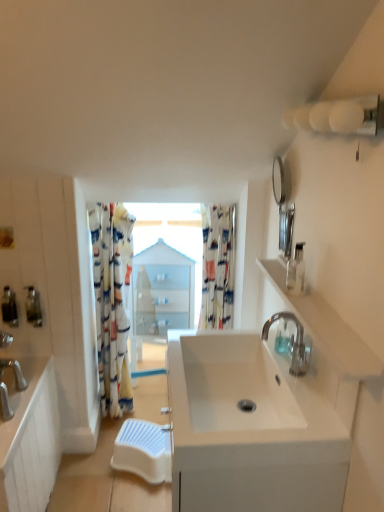
Question: Is translucent plastic soap dispenser at left, the 2th soap dispenser positioned from the right, directly adjacent to satin nickel cabinet at left?

Choices:
 (A) no
 (B) yes

Answer: (A)

Question: From the image's perspective, does translucent plastic soap dispenser at left, which is counted as the 1th soap dispenser, starting from the back, appear lower than satin nickel cabinet at left?

Choices:
 (A) yes
 (B) no

Answer: (B)

Question: Is translucent plastic soap dispenser at left, which appears as the 2th soap dispenser when viewed from the left, closer to the viewer compared to satin nickel cabinet at left?

Choices:
 (A) no
 (B) yes

Answer: (A)

Question: Considering the relative sizes of translucent plastic soap dispenser at left, the 2th soap dispenser positioned from the right, and satin nickel cabinet at left in the image provided, is translucent plastic soap dispenser at left, the 2th soap dispenser positioned from the right, thinner than satin nickel cabinet at left?

Choices:
 (A) no
 (B) yes

Answer: (B)

Question: Are translucent plastic soap dispenser at left, which appears as the 2th soap dispenser when viewed from the left, and satin nickel cabinet at left far apart?

Choices:
 (A) yes
 (B) no

Answer: (B)

Question: Is polished chrome faucet at center right taller or shorter than matte silver soap dispenser at left, which is the first soap dispenser in left-to-right order?

Choices:
 (A) short
 (B) tall

Answer: (B)

Question: Is point (296, 358) positioned closer to the camera than point (6, 303)?

Choices:
 (A) closer
 (B) farther

Answer: (A)

Question: From the image's perspective, is polished chrome faucet at center right located above or below matte silver soap dispenser at left, which is the 2th soap dispenser in back-to-front order?

Choices:
 (A) below
 (B) above

Answer: (A)

Question: In the image, is polished chrome faucet at center right positioned in front of or behind matte silver soap dispenser at left, positioned as the 3th soap dispenser in right-to-left order?

Choices:
 (A) front
 (B) behind

Answer: (A)

Question: Which is correct: satin nickel cabinet at left is inside polished chrome faucet at center right, or outside of it?

Choices:
 (A) outside
 (B) inside

Answer: (A)

Question: Considering the relative positions of satin nickel cabinet at left and polished chrome faucet at center right in the image provided, is satin nickel cabinet at left to the left or to the right of polished chrome faucet at center right?

Choices:
 (A) right
 (B) left

Answer: (B)

Question: From a real-world perspective, is satin nickel cabinet at left above or below polished chrome faucet at center right?

Choices:
 (A) below
 (B) above

Answer: (A)

Question: Is point (23, 373) closer or farther from the camera than point (302, 330)?

Choices:
 (A) farther
 (B) closer

Answer: (A)

Question: Looking at the image, does printed fabric shower curtain at left, the first shower curtain when ordered from left to right, seem bigger or smaller compared to white ceramic sink at center?

Choices:
 (A) small
 (B) big

Answer: (A)

Question: Relative to white ceramic sink at center, is printed fabric shower curtain at left, the first shower curtain when ordered from left to right, in front or behind?

Choices:
 (A) front
 (B) behind

Answer: (B)